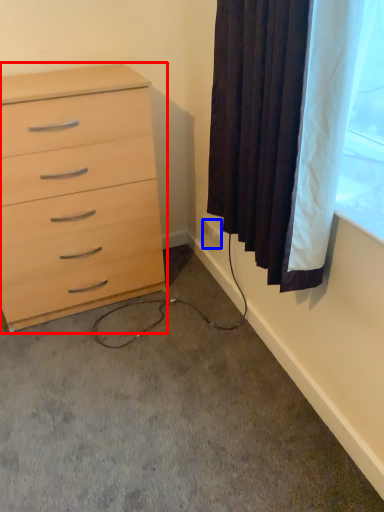
Question: Which of the following is the closest to the observer, chest of drawers (highlighted by a red box) or electric outlet (highlighted by a blue box)?

Choices:
 (A) chest of drawers
 (B) electric outlet

Answer: (A)